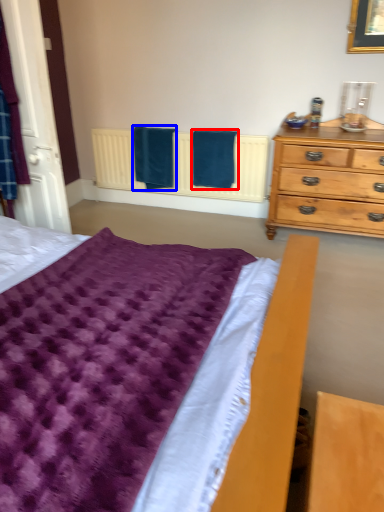
Question: Which object appears closest to the camera in this image, bath towel (highlighted by a red box) or bath towel (highlighted by a blue box)?

Choices:
 (A) bath towel
 (B) bath towel

Answer: (A)